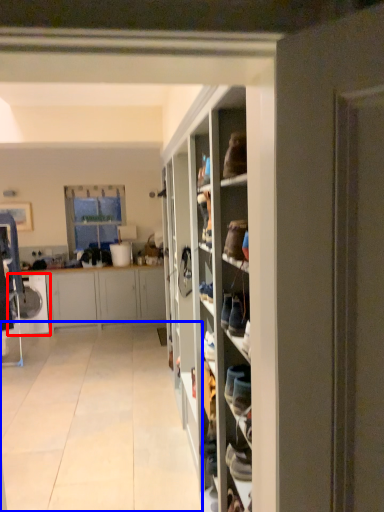
Question: Which object appears farthest to the camera in this image, washing machine (highlighted by a red box) or corridor (highlighted by a blue box)?

Choices:
 (A) washing machine
 (B) corridor

Answer: (A)